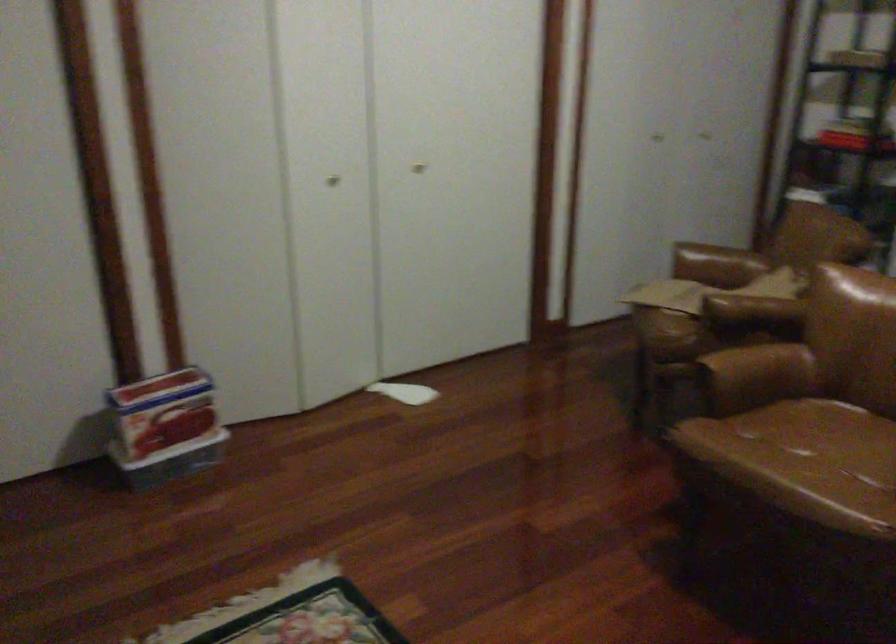
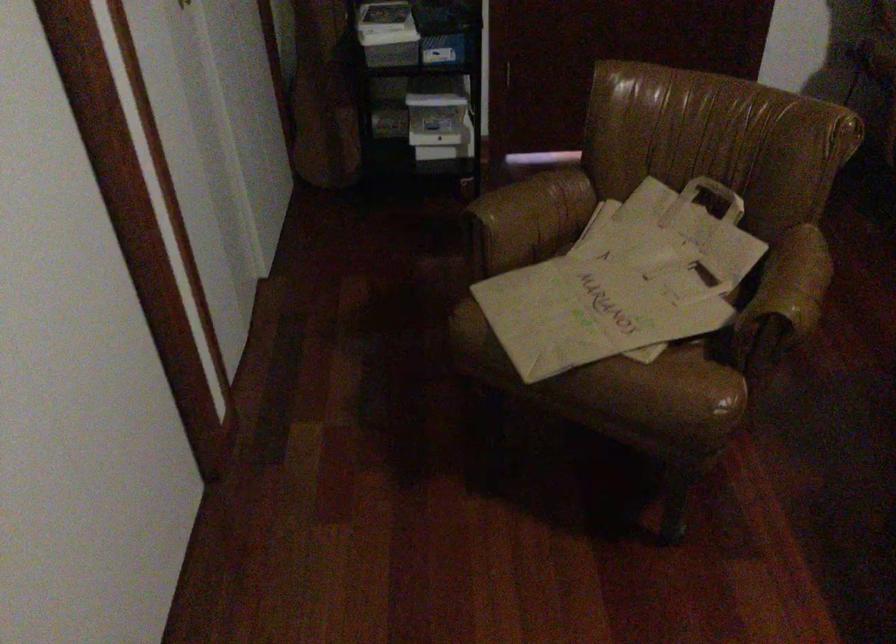
Where in the second image is the point corresponding to (x=760, y=299) from the first image?

(803, 275)